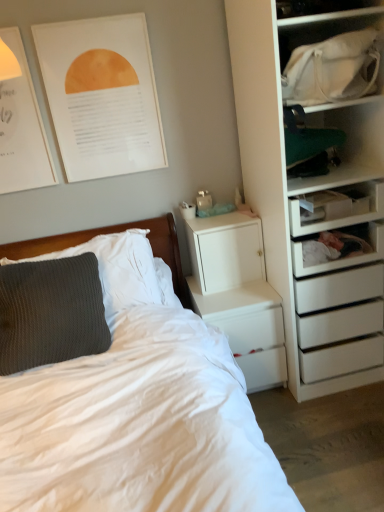
Question: Is white plastic drawer at right wider or thinner than matte paper poster at upper left, the first poster page when ordered from left to right?

Choices:
 (A) thin
 (B) wide

Answer: (B)

Question: Relative to matte paper poster at upper left, the first poster page when ordered from left to right, is white plastic drawer at right in front or behind?

Choices:
 (A) behind
 (B) front

Answer: (B)

Question: Considering the real-world distances, which object is farthest from the white plastic drawer at right?

Choices:
 (A) knitted gray pillow at left, the 2th pillow in the back-to-front sequence
 (B) knitted gray pillow at left, the 2th pillow in the front-to-back sequence
 (C) white matte/file cabinet at upper right
 (D) white paper poster at upper left, the 2th poster page when ordered from left to right
 (E) white soft bed at left

Answer: (A)

Question: Which is nearer to the white glossy nightstand at lower center?

Choices:
 (A) white soft bed at left
 (B) knitted gray pillow at left, the 2th pillow in the back-to-front sequence
 (C) white plastic drawer at right
 (D) white matte/file cabinet at upper right
 (E) white paper poster at upper left, the first poster page in the right-to-left sequence

Answer: (D)